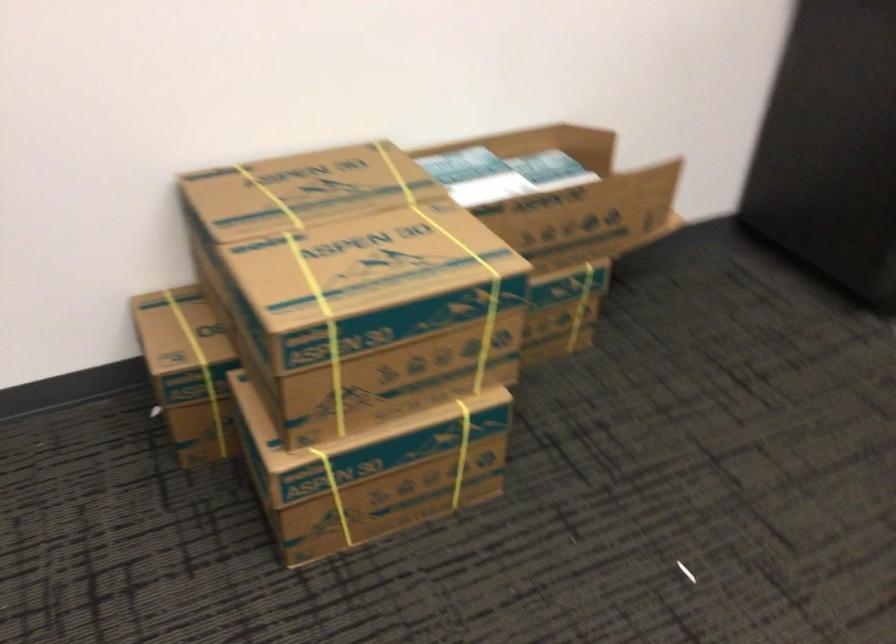
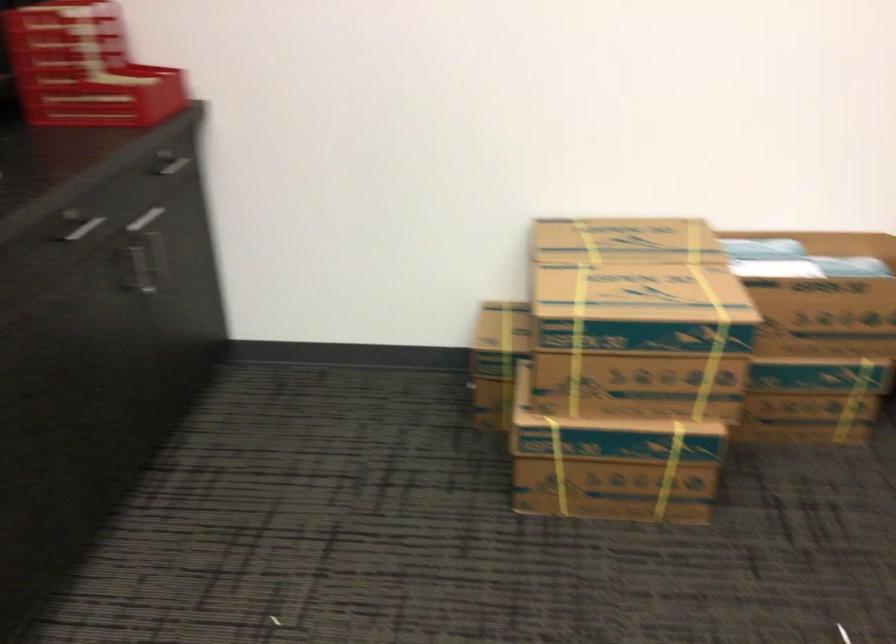
Find the pixel in the second image that matches point 321,191 in the first image.

(624, 241)